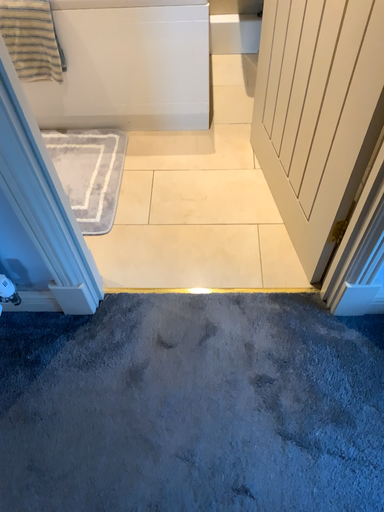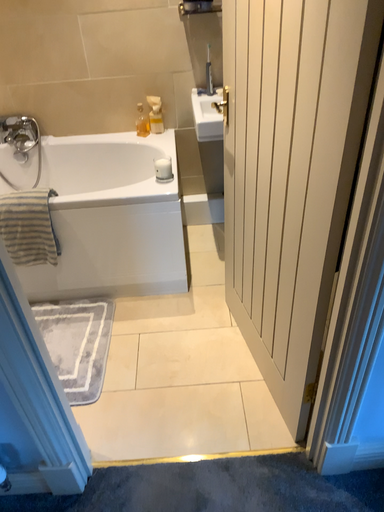
Question: Which way did the camera rotate in the video?

Choices:
 (A) rotated upward
 (B) rotated downward

Answer: (A)